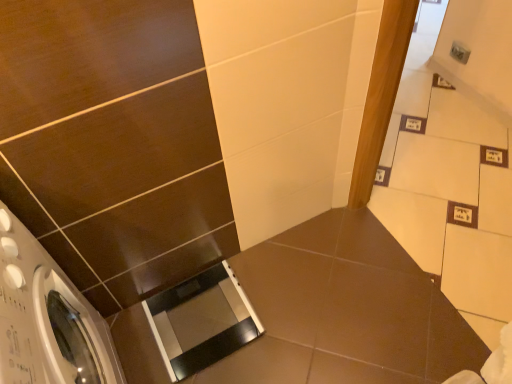
Question: From the image's perspective, is black glossy scale at lower center over transparent plastic screen door at lower center?

Choices:
 (A) no
 (B) yes

Answer: (A)

Question: Is black glossy scale at lower center positioned far away from transparent plastic screen door at lower center?

Choices:
 (A) no
 (B) yes

Answer: (A)

Question: Is black glossy scale at lower center to the left of transparent plastic screen door at lower center from the viewer's perspective?

Choices:
 (A) yes
 (B) no

Answer: (B)

Question: Is the position of black glossy scale at lower center less distant than that of transparent plastic screen door at lower center?

Choices:
 (A) no
 (B) yes

Answer: (B)

Question: Can you confirm if black glossy scale at lower center is smaller than transparent plastic screen door at lower center?

Choices:
 (A) yes
 (B) no

Answer: (B)

Question: Does black glossy scale at lower center touch transparent plastic screen door at lower center?

Choices:
 (A) no
 (B) yes

Answer: (A)

Question: Is transparent plastic screen door at lower center not close to white glossy washing machine at lower left?

Choices:
 (A) no
 (B) yes

Answer: (A)

Question: Is transparent plastic screen door at lower center positioned in front of white glossy washing machine at lower left?

Choices:
 (A) no
 (B) yes

Answer: (A)

Question: Considering the relative positions of transparent plastic screen door at lower center and white glossy washing machine at lower left in the image provided, is transparent plastic screen door at lower center to the left of white glossy washing machine at lower left from the viewer's perspective?

Choices:
 (A) yes
 (B) no

Answer: (B)

Question: Could you tell me if transparent plastic screen door at lower center is facing white glossy washing machine at lower left?

Choices:
 (A) yes
 (B) no

Answer: (B)

Question: From a real-world perspective, is transparent plastic screen door at lower center over white glossy washing machine at lower left?

Choices:
 (A) yes
 (B) no

Answer: (B)

Question: Is transparent plastic screen door at lower center turned away from white glossy washing machine at lower left?

Choices:
 (A) yes
 (B) no

Answer: (B)

Question: Does white glossy washing machine at lower left have a lesser height compared to black glossy scale at lower center?

Choices:
 (A) yes
 (B) no

Answer: (B)